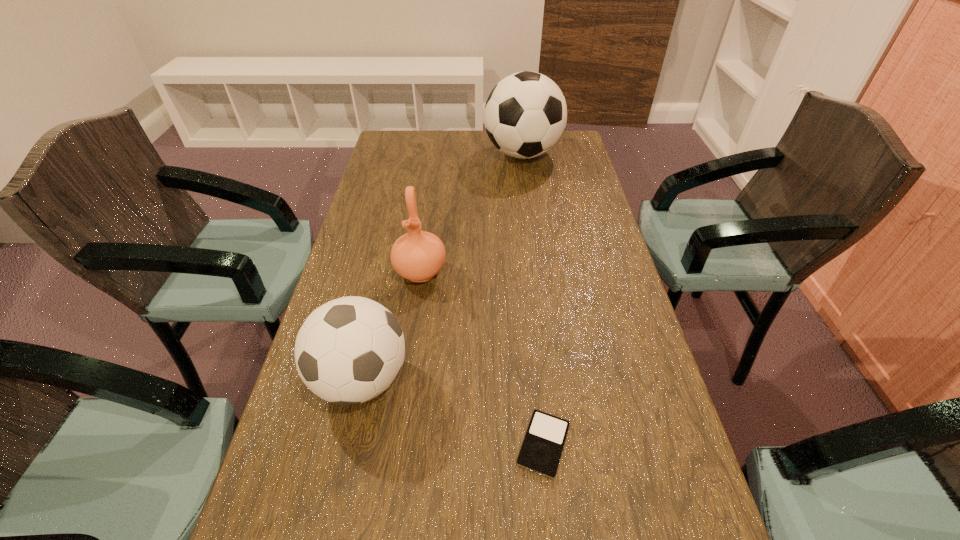
Locate an element on the screen. The width and height of the screenshot is (960, 540). object that is at the far edge is located at coordinates (525, 115).

Locate an element on the screen. The image size is (960, 540). pottery at the left edge is located at coordinates (418, 256).

At what (x,y) coordinates should I click in order to perform the action: click on soccer ball present at the left edge. Please return your answer as a coordinate pair (x, y). This screenshot has height=540, width=960. Looking at the image, I should click on (348, 351).

At what (x,y) coordinates should I click in order to perform the action: click on object at the right edge. Please return your answer as a coordinate pair (x, y). The image size is (960, 540). Looking at the image, I should click on (525, 115).

The width and height of the screenshot is (960, 540). I want to click on object that is at the far right corner, so click(x=525, y=115).

Find the location of a particular element. This screenshot has height=540, width=960. free space at the far edge of the desktop is located at coordinates (470, 139).

In the image, there is a desktop. Identify the location of vacant space at the left edge. This screenshot has height=540, width=960. pyautogui.click(x=360, y=285).

Find the location of a particular element. This screenshot has height=540, width=960. blank space at the right edge of the desktop is located at coordinates (692, 506).

I want to click on vacant space at the far left corner of the desktop, so click(x=417, y=141).

I want to click on free spot between the shorter soccer ball and the iPod, so click(x=452, y=412).